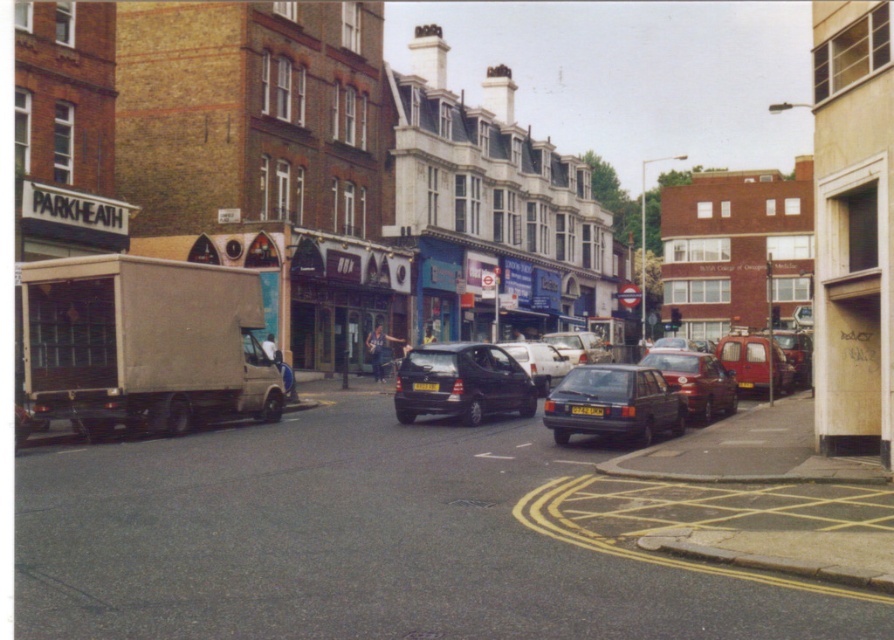
Question: Which of the following is the farthest from the observer?

Choices:
 (A) matte black hatchback at center
 (B) metallic red van at center-right

Answer: (B)

Question: Considering the relative positions of shiny black car at center and yellow metallic license plate at center in the image provided, where is shiny black car at center located with respect to yellow metallic license plate at center?

Choices:
 (A) above
 (B) below

Answer: (B)

Question: Which object is the farthest from the shiny red car at center?

Choices:
 (A) shiny black car at center
 (B) metallic red van at right
 (C) matte black car at center

Answer: (C)

Question: Is white matte van at center positioned at the back of metallic red van at center-right?

Choices:
 (A) no
 (B) yes

Answer: (A)

Question: Considering the real-world distances, which object is farthest from the yellow metallic license plate at center?

Choices:
 (A) white matte van at center
 (B) matte black car at center
 (C) dark blue matte hatchback at center

Answer: (B)

Question: Observing the image, what is the correct spatial positioning of dark blue matte hatchback at center in reference to shiny red car at center?

Choices:
 (A) left
 (B) right

Answer: (A)